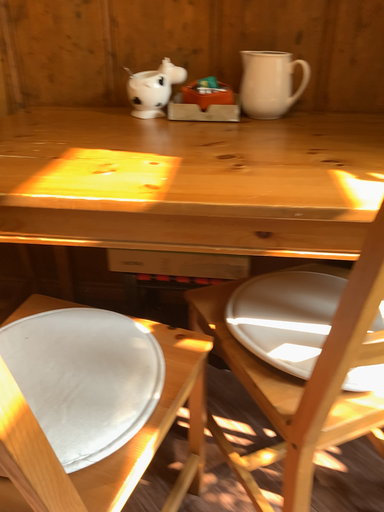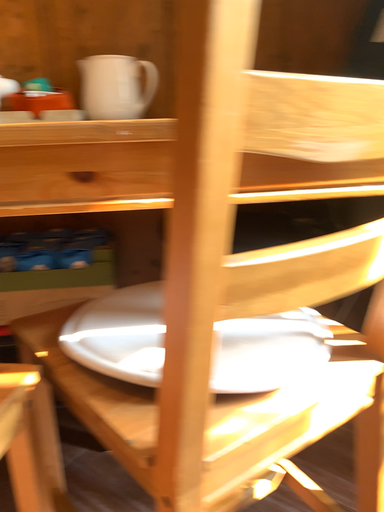
Question: How did the camera likely rotate when shooting the video?

Choices:
 (A) rotated left
 (B) rotated right

Answer: (B)